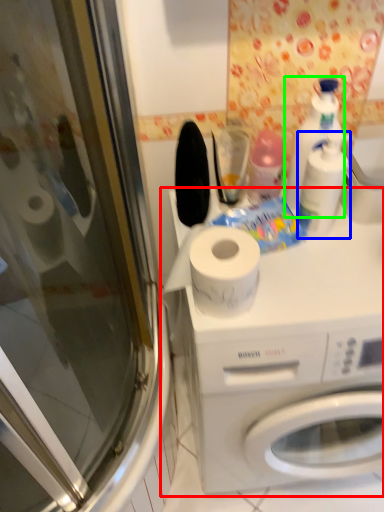
Question: Which object is the farthest from washing machine (highlighted by a red box)? Choose among these: cleaning product (highlighted by a blue box) or cleaning product (highlighted by a green box).

Choices:
 (A) cleaning product
 (B) cleaning product

Answer: (B)